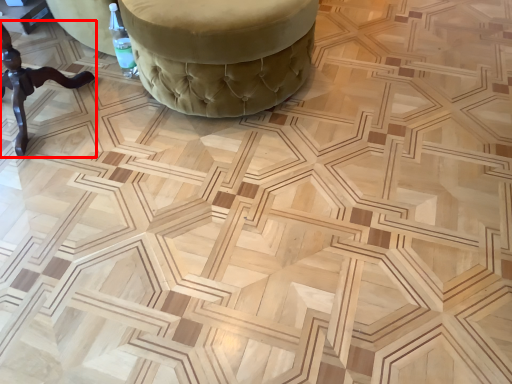
Question: From the image's perspective, considering the relative positions of furniture (annotated by the red box) and furniture in the image provided, where is furniture (annotated by the red box) located with respect to the staircase?

Choices:
 (A) below
 (B) above

Answer: (A)